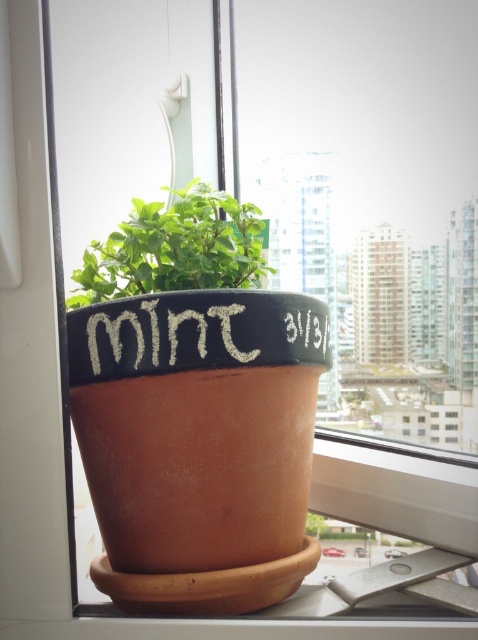
Can you confirm if green matte mint at center is positioned to the right of white chalk mint at center?

Incorrect, green matte mint at center is not on the right side of white chalk mint at center.

In the scene shown: Which is more to the left, green matte mint at center or white chalk mint at center?

Positioned to the left is green matte mint at center.

Is point (240, 243) closer to camera compared to point (97, 321)?

No, (240, 243) is behind (97, 321).

Where is `green matte mint at center`? green matte mint at center is located at coordinates (173, 248).